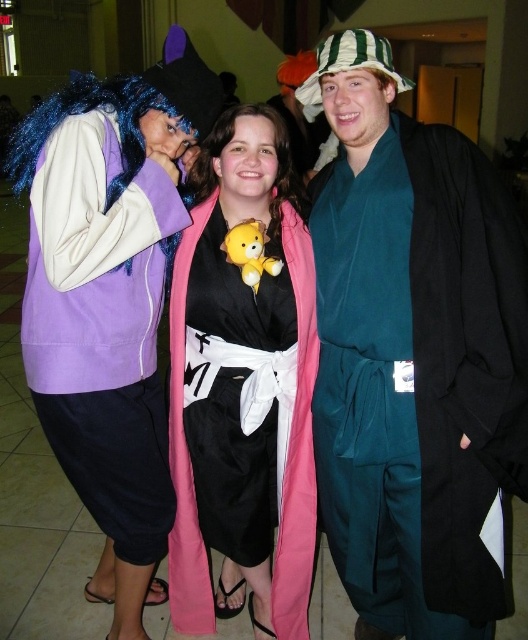
You are a photographer at the event and need to frame a shot that includes both the purple matte jacket at left and the pink fabric teddy bear at center. Considering their sizes, which object should you ensure is closer to the camera to maintain both in the frame without cropping?

The purple matte jacket at left is wider than the pink fabric teddy bear at center. To keep both in the frame without cropping, position the purple matte jacket at left closer to the camera since its larger width requires more space.

You are a photographer at the event and need to capture a photo where both the purple matte jacket at left and the pink fabric teddy bear at center are clearly visible. Given that the teddy bear is smaller, which object should you focus on to ensure both are in frame without cropping?

Since the purple matte jacket at left is larger than the pink fabric teddy bear at center, you should focus on the purple matte jacket at left to ensure both objects are fully visible in the photo.

You are standing in the convention center and want to locate the teal silk kimono at center. Which direction should you look relative to your current position?

You should look towards the center of the convention center to find the teal silk kimono at center.